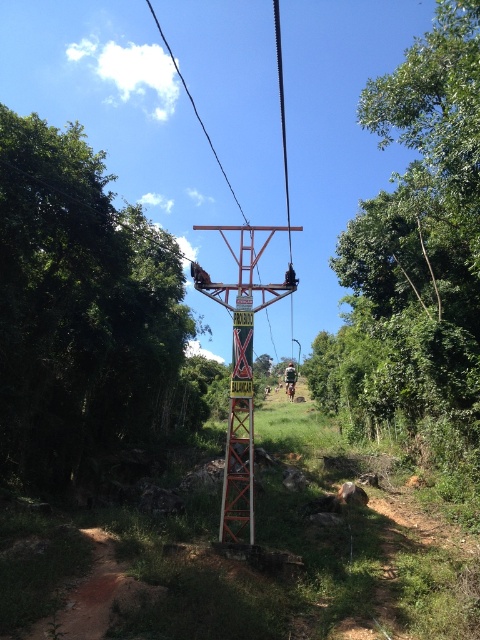
You are standing at the starting point of the zipline and want to know how far the green leafy tree at center is from your current position. Can you determine the distance?

The green leafy tree at center is 39.60 feet away from the camera, so it is approximately 39.60 feet away from your current position.

You are standing at the starting point of the zipline and looking towards the red metal frame structure. Which direction should you look to see the green leafy tree at center?

The green leafy tree at center is located at point (415, 253), which is directly in the center of the image. Since you are facing the red metal frame structure, you should look straight ahead to see the green leafy tree at center.